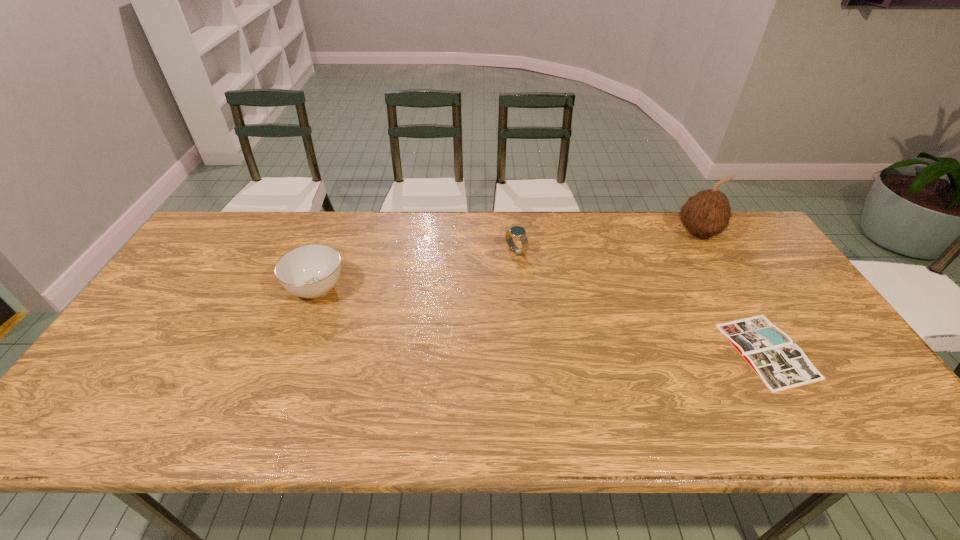
The width and height of the screenshot is (960, 540). Find the location of `vacant space at the far right corner of the desktop`. vacant space at the far right corner of the desktop is located at coordinates [x=735, y=217].

I want to click on free space that is in between the tallest object and the shortest object, so click(x=732, y=292).

You are a GUI agent. You are given a task and a screenshot of the screen. Output one action in this format:
    pyautogui.click(x=<x>, y=<y>)
    Task: Click on the vacant space that is in between the tallest object and the second nearest object
    
    Given the screenshot: What is the action you would take?
    pyautogui.click(x=507, y=261)

This screenshot has width=960, height=540. What are the coordinates of `vacant area that lies between the nearest object and the third farthest object` in the screenshot? It's located at (541, 320).

The height and width of the screenshot is (540, 960). I want to click on free point between the book and the third object from right to left, so click(x=641, y=301).

Identify the location of empty space that is in between the second tallest object and the tallest object. The image size is (960, 540). pyautogui.click(x=507, y=261).

Where is `vacant space that's between the third tallest object and the shortest object`? vacant space that's between the third tallest object and the shortest object is located at coordinates (641, 301).

The image size is (960, 540). I want to click on vacant point located between the third farthest object and the tallest object, so click(x=507, y=261).

Image resolution: width=960 pixels, height=540 pixels. What are the coordinates of `free space between the nearest object and the third tallest object` in the screenshot? It's located at (641, 301).

Image resolution: width=960 pixels, height=540 pixels. What are the coordinates of `vacant area between the leftmost object and the coconut` in the screenshot? It's located at (507, 261).